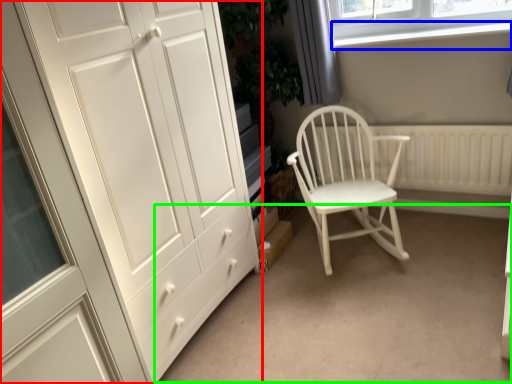
Question: Considering the real-world distances, which object is closest to cupboard (highlighted by a red box)? window sill (highlighted by a blue box) or plain (highlighted by a green box).

Choices:
 (A) window sill
 (B) plain

Answer: (B)